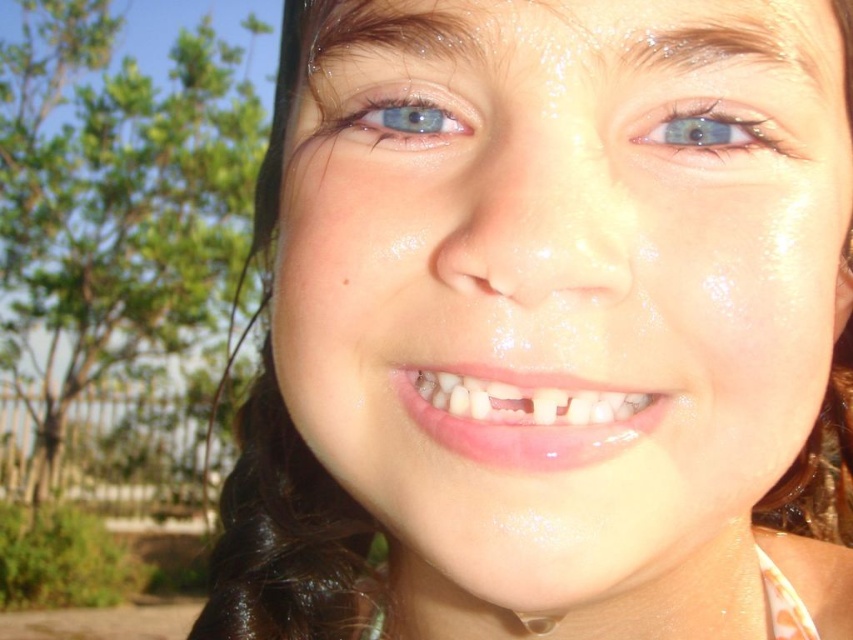
You are a photographer trying to capture the reflection in the blue glossy eye at upper right and the blue glossy eye at upper center. Which eye requires a wider aperture setting to capture its reflection properly?

The blue glossy eye at upper right requires a wider aperture setting because its width surpasses that of the blue glossy eye at upper center, necessitating more light intake to properly capture the reflection.